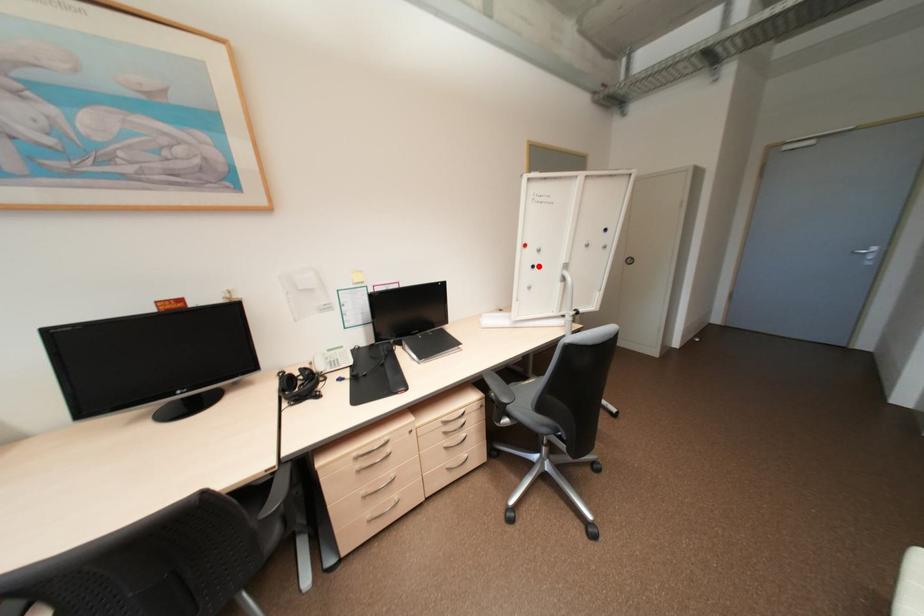
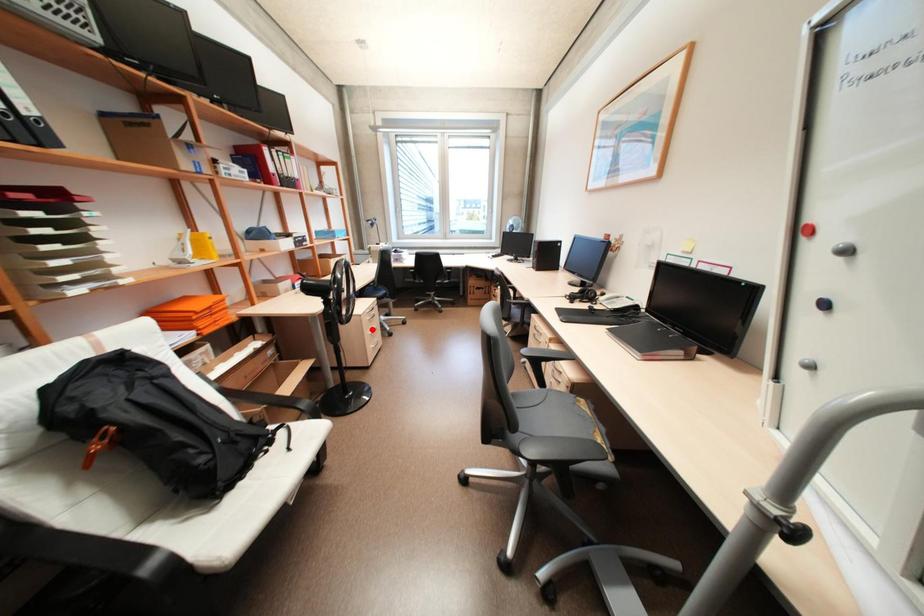
I am providing you with two images of the same scene from different viewpoints. A red point is marked on the first image and another point is marked on the second image. Are the points marked in image1 and image2 representing the same 3D position?

No